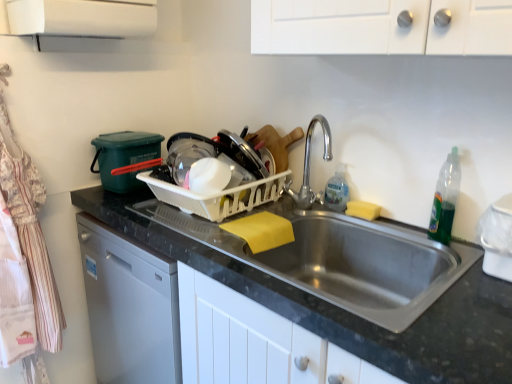
Question: Does green translucent bottle at right have a greater width compared to white plastic basket at center?

Choices:
 (A) no
 (B) yes

Answer: (A)

Question: Would you say white plastic basket at center is part of green translucent bottle at right's contents?

Choices:
 (A) yes
 (B) no

Answer: (B)

Question: Is green translucent bottle at right taller than white plastic basket at center?

Choices:
 (A) no
 (B) yes

Answer: (B)

Question: From a real-world perspective, is green translucent bottle at right located beneath white plastic basket at center?

Choices:
 (A) no
 (B) yes

Answer: (A)

Question: Can you confirm if green translucent bottle at right is shorter than white plastic basket at center?

Choices:
 (A) no
 (B) yes

Answer: (A)

Question: Is green translucent bottle at right facing towards white plastic basket at center?

Choices:
 (A) yes
 (B) no

Answer: (B)

Question: Is striped cotton apron at left with black granite countertop at center?

Choices:
 (A) no
 (B) yes

Answer: (A)

Question: Is striped cotton apron at left further to camera compared to black granite countertop at center?

Choices:
 (A) no
 (B) yes

Answer: (B)

Question: From the image's perspective, is striped cotton apron at left under black granite countertop at center?

Choices:
 (A) no
 (B) yes

Answer: (A)

Question: Is striped cotton apron at left to the left of black granite countertop at center from the viewer's perspective?

Choices:
 (A) yes
 (B) no

Answer: (A)

Question: Is striped cotton apron at left positioned before black granite countertop at center?

Choices:
 (A) no
 (B) yes

Answer: (A)

Question: Is black granite countertop at center completely or partially inside striped cotton apron at left?

Choices:
 (A) yes
 (B) no

Answer: (B)

Question: From a real-world perspective, is white plastic basket at center over striped cotton apron at left?

Choices:
 (A) no
 (B) yes

Answer: (B)